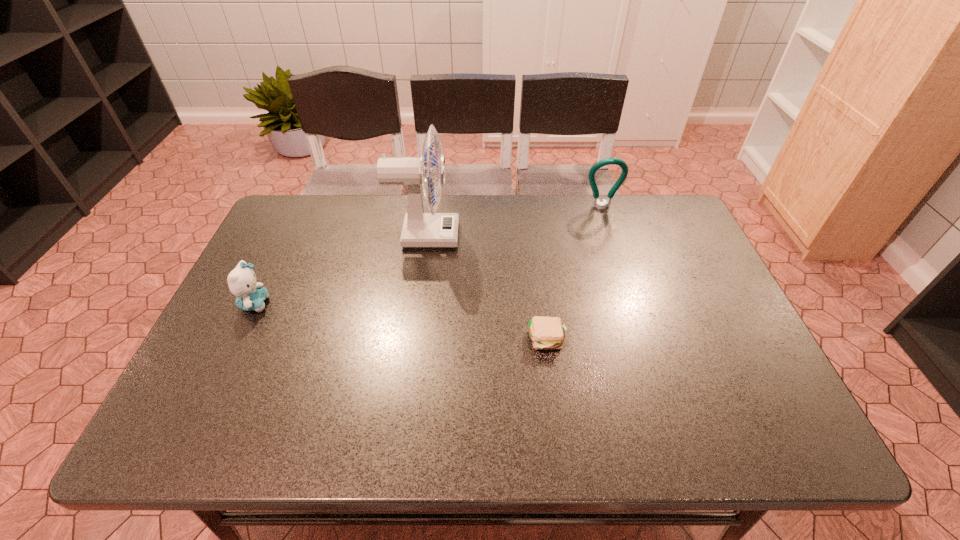
The height and width of the screenshot is (540, 960). I want to click on the tallest object, so click(x=420, y=230).

Locate an element on the screen. the third object from right to left is located at coordinates (420, 230).

What are the coordinates of `bottle opener` in the screenshot? It's located at (596, 203).

In order to click on the rightmost object in this screenshot , I will do `click(596, 203)`.

Find the location of a particular element. the third tallest object is located at coordinates (250, 295).

You are a GUI agent. You are given a task and a screenshot of the screen. Output one action in this format:
    pyautogui.click(x=<x>, y=<y>)
    Task: Click on the kitten
    The image size is (960, 540).
    Given the screenshot: What is the action you would take?
    pyautogui.click(x=250, y=295)

Where is `patty`? patty is located at coordinates (546, 333).

This screenshot has width=960, height=540. What are the coordinates of `the third object from left to right` in the screenshot? It's located at (546, 333).

Locate an element on the screen. vacant space located 0.120m on the front-facing side of the third object from right to left is located at coordinates (497, 235).

I want to click on free space located 0.130m at the jaws of the rightmost object, so click(x=611, y=238).